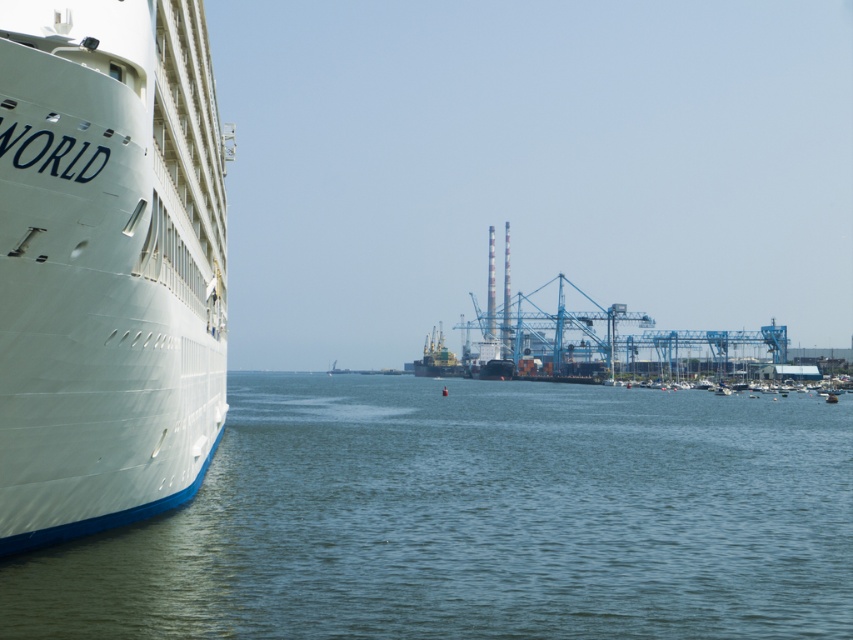
You are standing on the deck of the cruise ship and looking down. Where exactly is the clear blue water at lower left located in terms of coordinates?

The clear blue water at lower left is located at coordinates point (476, 518).

You are a photographer standing on the dock and want to capture the metallic gray ship at center and the clear blue water at lower left in the same frame. Based on their positions, which object should be placed to the right in your photo?

The clear blue water at lower left is positioned on the right side of the metallic gray ship at center, so in your photo, the clear blue water at lower left should be placed to the right of the metallic gray ship at center.